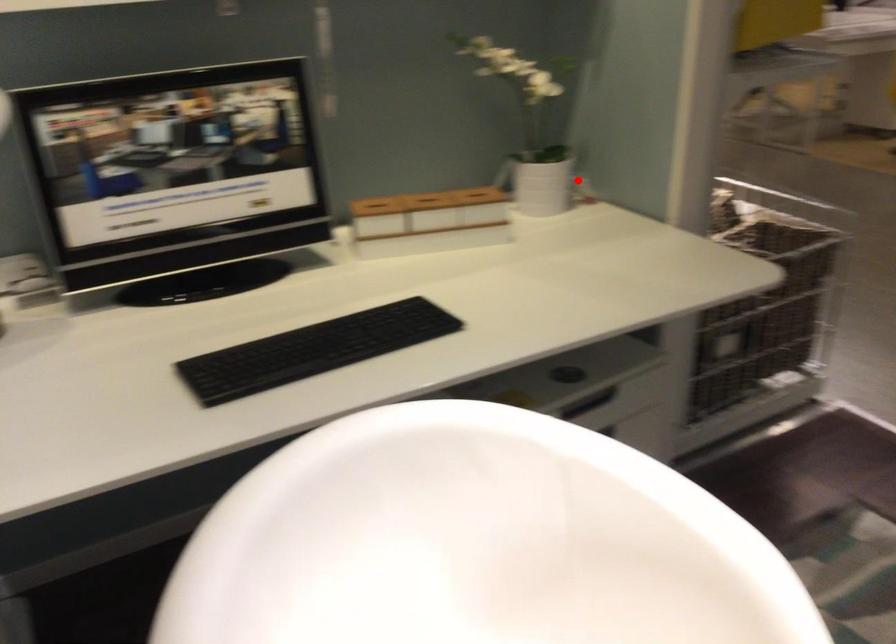
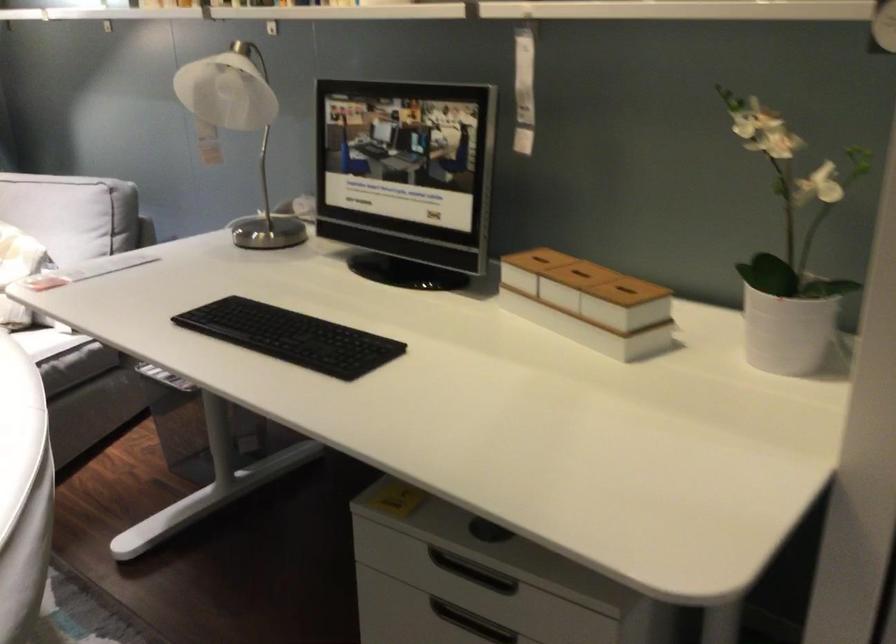
The point at the highlighted location is marked in the first image. Where is the corresponding point in the second image?

(787, 332)